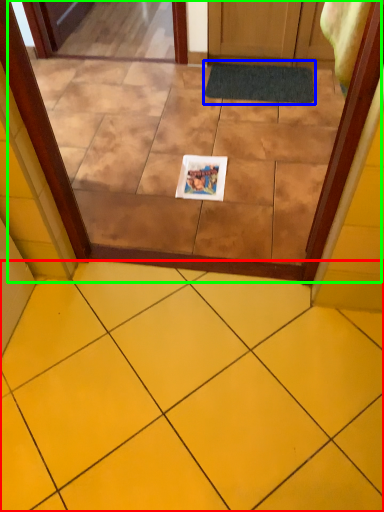
Question: Based on their relative distances, which object is nearer to ceramic tile (highlighted by a red box)? Choose from bath mat (highlighted by a blue box) and glass door (highlighted by a green box).

Choices:
 (A) bath mat
 (B) glass door

Answer: (B)